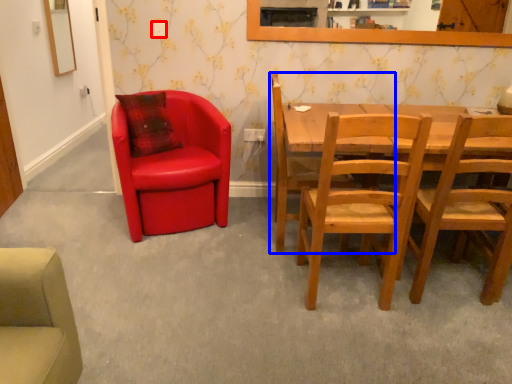
Question: Among these objects, which one is nearest to the camera, power outlet (highlighted by a red box) or chair (highlighted by a blue box)?

Choices:
 (A) power outlet
 (B) chair

Answer: (B)